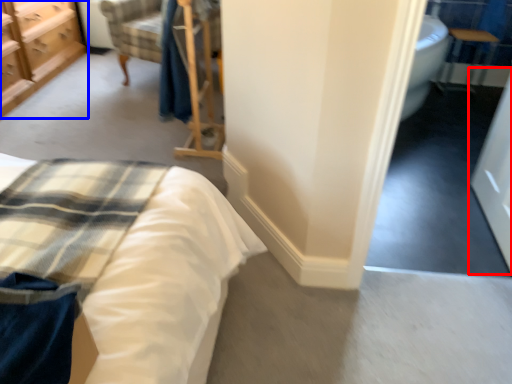
Question: Which point is closer to the camera, screen door (highlighted by a red box) or chest of drawers (highlighted by a blue box)?

Choices:
 (A) screen door
 (B) chest of drawers

Answer: (A)